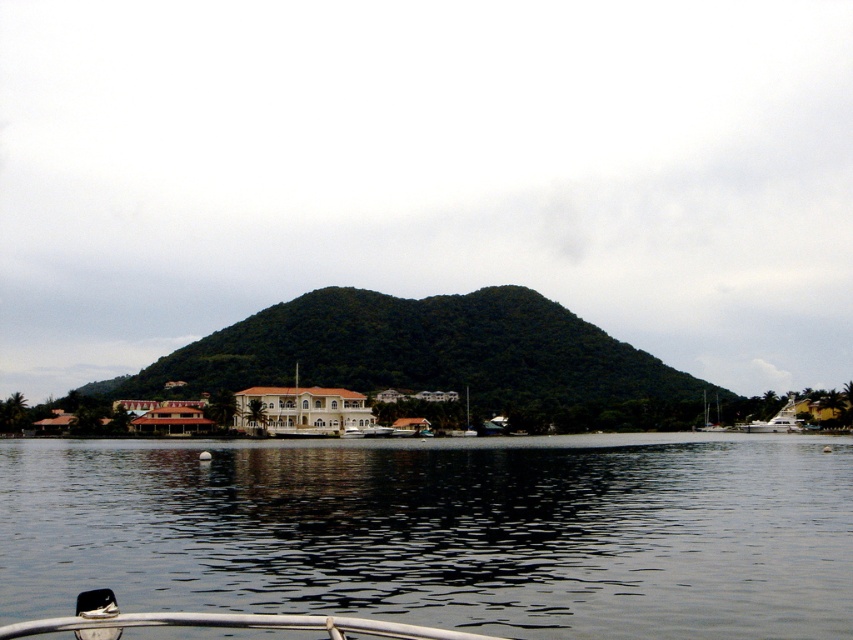
Question: Can you confirm if white glossy boat at lower right is smaller than white glossy sailboat at lower right?

Choices:
 (A) no
 (B) yes

Answer: (A)

Question: Is green leafy mountain at center further to the viewer compared to white glossy sailboat at lower right?

Choices:
 (A) yes
 (B) no

Answer: (B)

Question: Does transparent water at center have a larger size compared to white glossy sailboat at lower right?

Choices:
 (A) no
 (B) yes

Answer: (B)

Question: Which object is farther from the camera taking this photo?

Choices:
 (A) white glossy boat at lower right
 (B) green leafy mountain at center
 (C) white glossy sailboat at lower right

Answer: (C)

Question: Which object appears farthest from the camera in this image?

Choices:
 (A) transparent water at center
 (B) white glossy boat at lower right

Answer: (B)

Question: Among these objects, which one is farthest from the camera?

Choices:
 (A) white glossy boat at lower right
 (B) white glossy sailboat at lower right

Answer: (B)